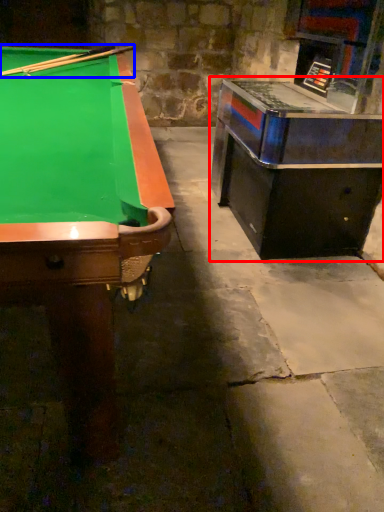
Question: Which of the following is the closest to the observer, table (highlighted by a red box) or cue (highlighted by a blue box)?

Choices:
 (A) table
 (B) cue

Answer: (A)